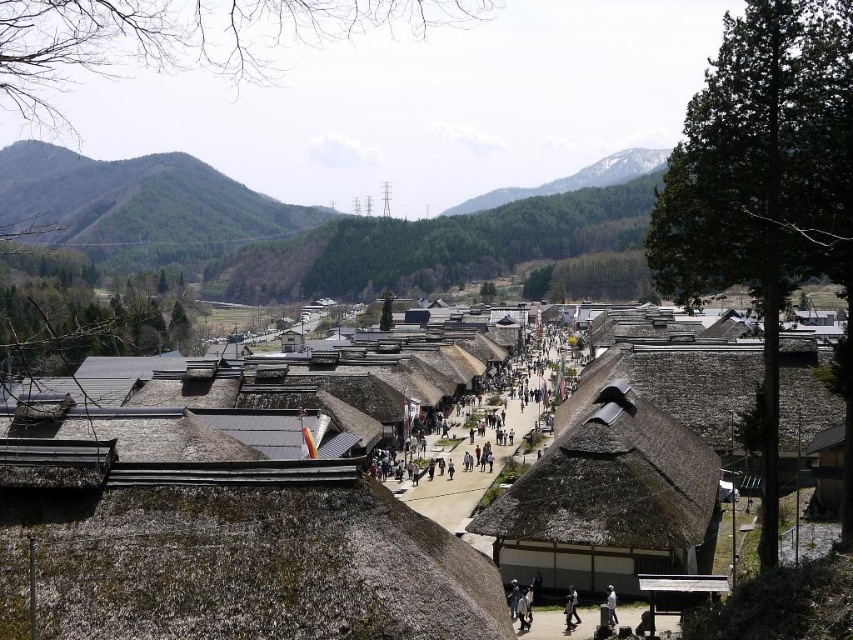
Does thatched roof village at center appear on the right side of white fabric person at lower center?

Incorrect, thatched roof village at center is not on the right side of white fabric person at lower center.

Which is behind, point (56, 476) or point (610, 612)?

The point (610, 612) is more distant.

Identify the location of thatched roof village at center. (337, 502).

Between point (123, 193) and point (607, 611), which one is positioned in front?

Point (607, 611) is more forward.

Which is more to the left, green leafy hillside at upper left or white fabric person at lower center?

Positioned to the left is green leafy hillside at upper left.

Which is behind, point (286, 204) or point (616, 620)?

Positioned behind is point (286, 204).

The width and height of the screenshot is (853, 640). In order to click on green leafy hillside at upper left in this screenshot , I will do `click(138, 205)`.

Measure the distance between green forested mountain at upper center and white fabric person at lower center.

A distance of 1404.02 feet exists between green forested mountain at upper center and white fabric person at lower center.

Is point (631, 163) in front of point (613, 605)?

No, (631, 163) is further to viewer.

Who is more forward, [531,189] or [611,605]?

Point [611,605]

Find the location of `green forested mountain at upper center`. green forested mountain at upper center is located at coordinates (573, 179).